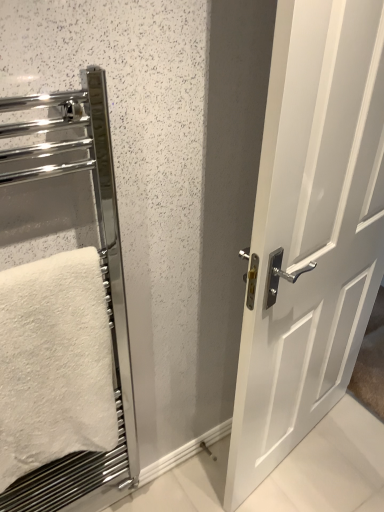
Question: From the image's perspective, is white fluffy towel at left located above white glossy door at center?

Choices:
 (A) yes
 (B) no

Answer: (B)

Question: Does white fluffy towel at left turn towards white glossy door at center?

Choices:
 (A) no
 (B) yes

Answer: (A)

Question: Does white fluffy towel at left have a lesser height compared to white glossy door at center?

Choices:
 (A) yes
 (B) no

Answer: (A)

Question: From a real-world perspective, is white fluffy towel at left located higher than white glossy door at center?

Choices:
 (A) no
 (B) yes

Answer: (B)

Question: Is the surface of white fluffy towel at left in direct contact with white glossy door at center?

Choices:
 (A) yes
 (B) no

Answer: (B)

Question: Does white fluffy towel at left have a greater height compared to white glossy door at center?

Choices:
 (A) no
 (B) yes

Answer: (A)

Question: Does chrome metallic towel rack at left come in front of white glossy door at center?

Choices:
 (A) yes
 (B) no

Answer: (A)

Question: Would you say chrome metallic towel rack at left contains white glossy door at center?

Choices:
 (A) no
 (B) yes

Answer: (A)

Question: Is chrome metallic towel rack at left thinner than white glossy door at center?

Choices:
 (A) no
 (B) yes

Answer: (B)

Question: From the image's perspective, is chrome metallic towel rack at left below white glossy door at center?

Choices:
 (A) no
 (B) yes

Answer: (B)

Question: From a real-world perspective, does chrome metallic towel rack at left stand above white glossy door at center?

Choices:
 (A) no
 (B) yes

Answer: (B)

Question: From the image's perspective, is chrome metallic towel rack at left above white glossy door at center?

Choices:
 (A) no
 (B) yes

Answer: (A)

Question: Considering the relative sizes of white glossy door at center and chrome metallic towel rack at left in the image provided, is white glossy door at center thinner than chrome metallic towel rack at left?

Choices:
 (A) yes
 (B) no

Answer: (B)